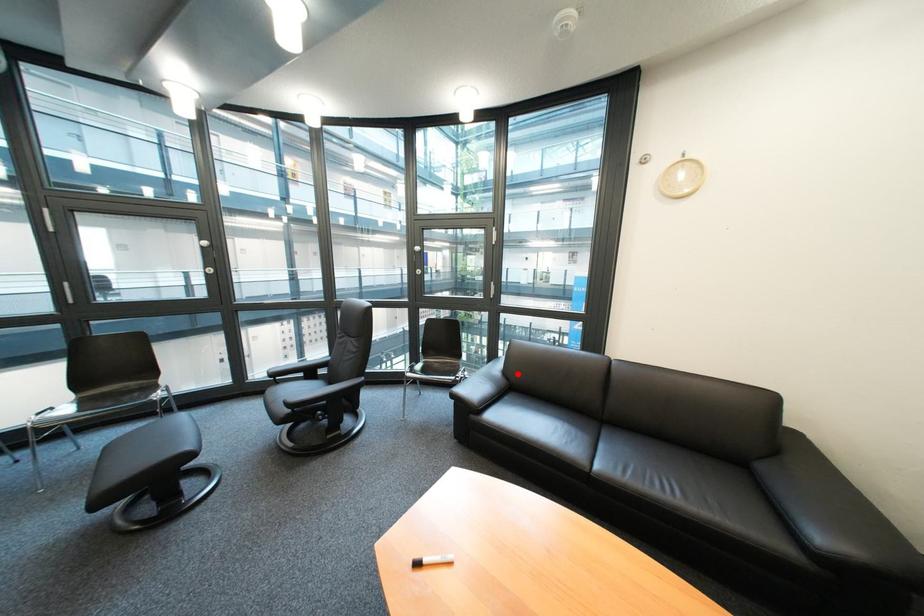
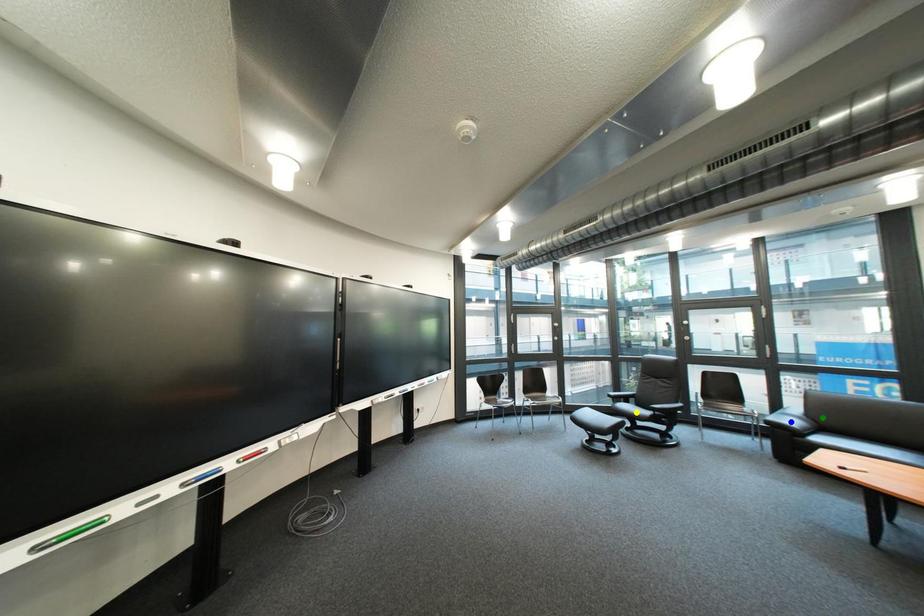
Question: I am providing you with two images of the same scene from different viewpoints. A red point is marked on the first image. You are given multiple points on the second image. Which mark in image 2 goes with the point in image 1?

Choices:
 (A) blue point
 (B) yellow point
 (C) green point

Answer: (C)